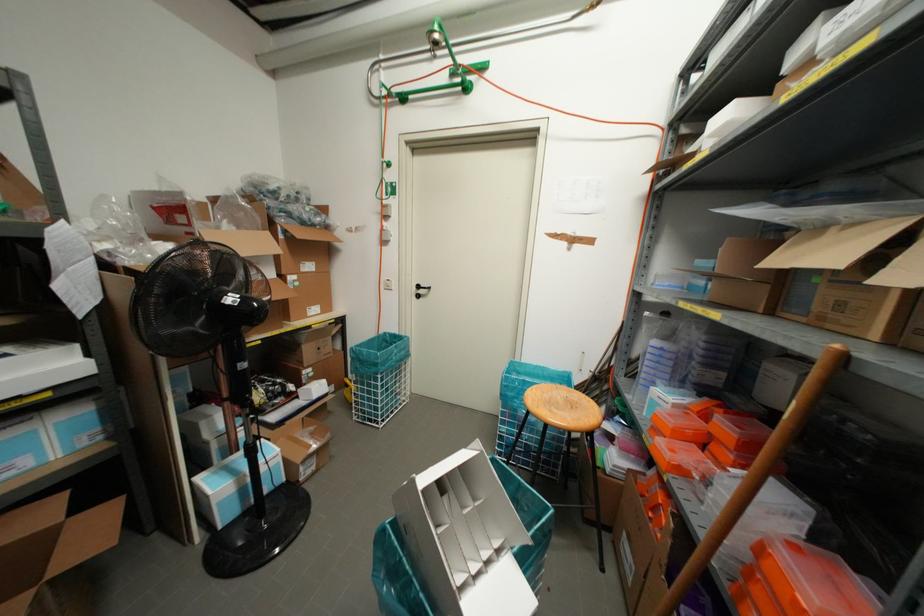
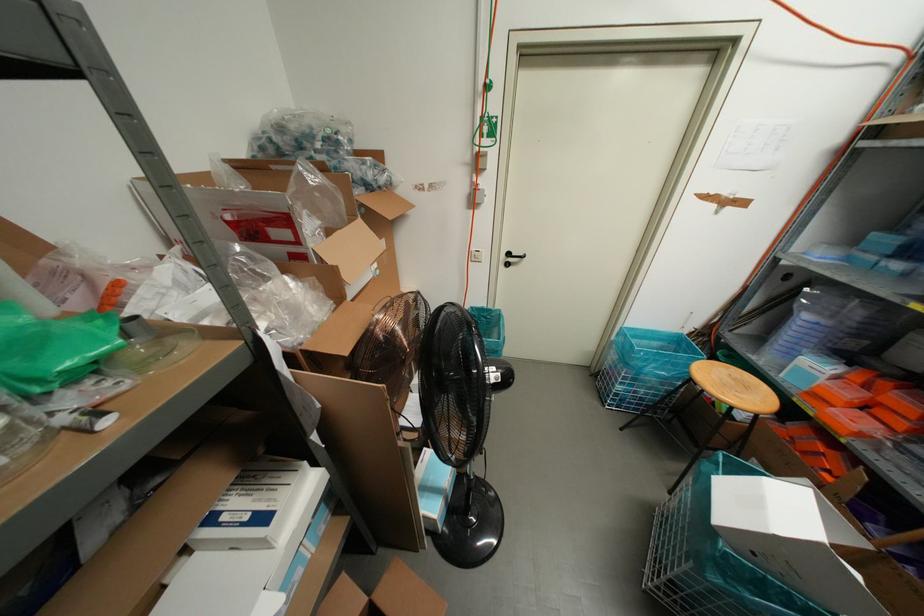
Question: The images are taken continuously from a first-person perspective. In which direction are you moving?

Choices:
 (A) Left
 (B) Right
 (C) Forward
 (D) Backward

Answer: (A)